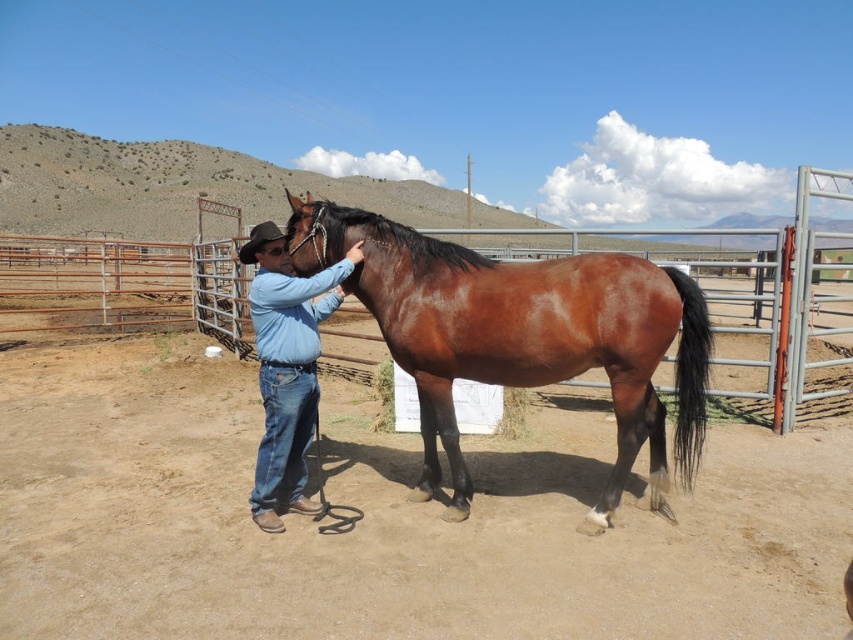
You are a photographer planning to take a photo of the brown glossy horse at center and the blue jeans at center. Since you want both subjects to appear clearly in the frame, which one should you focus on first to ensure proper depth of field?

The brown glossy horse at center is bigger than blue jeans at center, so you should focus on the brown glossy horse at center first to ensure proper depth of field.

You are a photographer standing at the back of the corral. You want to take a photo of the brown glossy horse at center and the blue jeans at center so that both are visible in the frame. Given their sizes, which object should you focus on to ensure both are in focus?

The brown glossy horse at center is much taller than the blue jeans at center, so focusing on the horse will ensure both are in focus since it is larger and farther away.

You are a farmer who needs to attach a 40 inch long rope to the brown glossy horse at center and the blue jeans at center to secure them. Will the rope be long enough to reach both ends?

The distance between the brown glossy horse at center and the blue jeans at center is 37.29 inches. Since the rope is 40 inches long, it is longer than the required distance. Therefore, the rope will be long enough to reach both ends.